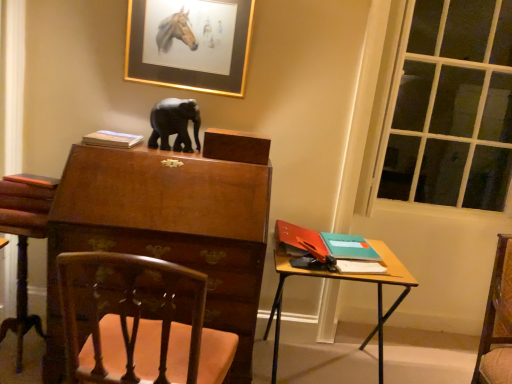
Where is `free space in front of transparent glass window at right`? This screenshot has width=512, height=384. free space in front of transparent glass window at right is located at coordinates (412, 370).